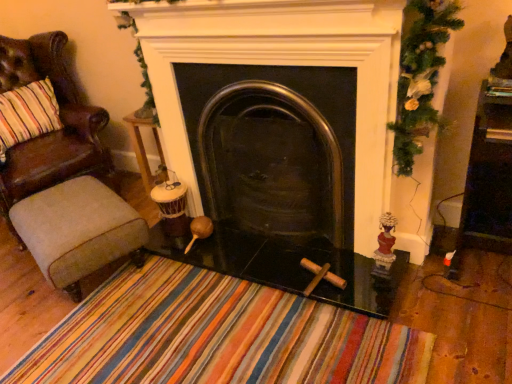
Question: In the image, is green textured garland at upper right positioned in front of or behind wooden side table at center?

Choices:
 (A) behind
 (B) front

Answer: (B)

Question: Is point (415, 21) positioned closer to the camera than point (138, 152)?

Choices:
 (A) closer
 (B) farther

Answer: (A)

Question: Which object is the farthest from the beige fabric stool at lower left?

Choices:
 (A) transparent glass table at center
 (B) black glass fireplace at center
 (C) matte red figurine at right
 (D) wooden side table at center
 (E) green textured garland at upper right

Answer: (E)

Question: Which is farther from the brown leather chair at left?

Choices:
 (A) matte red figurine at right
 (B) wooden side table at center
 (C) beige fabric stool at lower left
 (D) green textured garland at upper right
 (E) black glass fireplace at center

Answer: (A)